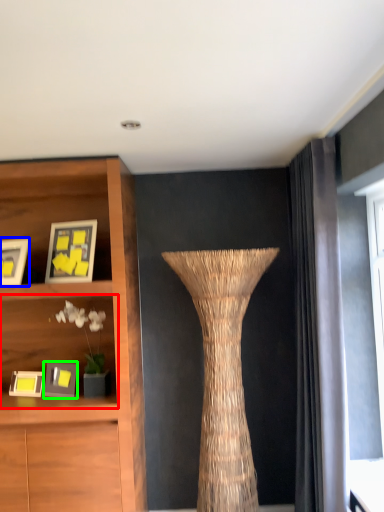
Question: Which is farther away from shelf (highlighted by a red box)? picture frame (highlighted by a blue box) or picture frame (highlighted by a green box)?

Choices:
 (A) picture frame
 (B) picture frame

Answer: (A)